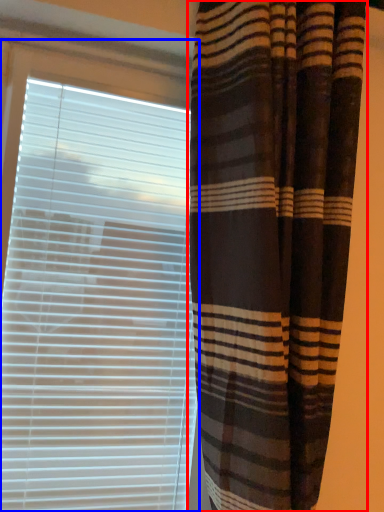
Question: Which object appears closest to the camera in this image, curtain (highlighted by a red box) or window blind (highlighted by a blue box)?

Choices:
 (A) curtain
 (B) window blind

Answer: (A)